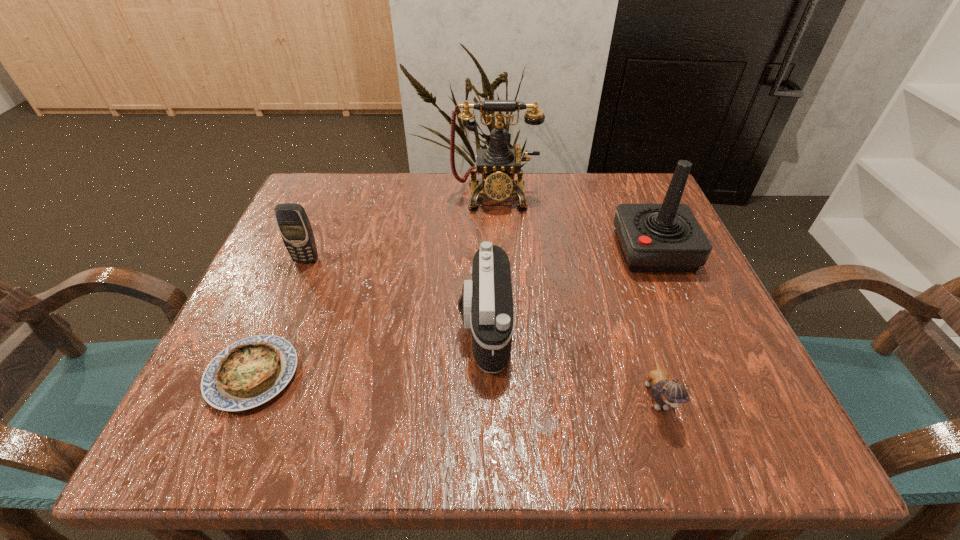
Find the location of a particular element. Image resolution: width=960 pixels, height=540 pixels. quiche situated at the left edge is located at coordinates (249, 372).

The width and height of the screenshot is (960, 540). Find the location of `joystick located in the right edge section of the desktop`. joystick located in the right edge section of the desktop is located at coordinates (667, 237).

Where is `kitten that is at the right edge`? The height and width of the screenshot is (540, 960). kitten that is at the right edge is located at coordinates (666, 392).

You are a GUI agent. You are given a task and a screenshot of the screen. Output one action in this format:
    pyautogui.click(x=<x>, y=<y>)
    Task: Click on the object at the near left corner
    Image resolution: width=960 pixels, height=540 pixels.
    Given the screenshot: What is the action you would take?
    pyautogui.click(x=249, y=372)

You are a GUI agent. You are given a task and a screenshot of the screen. Output one action in this format:
    pyautogui.click(x=<x>, y=<y>)
    Task: Click on the object present at the far right corner
    
    Given the screenshot: What is the action you would take?
    pyautogui.click(x=667, y=237)

Locate an element on the screen. The width and height of the screenshot is (960, 540). object that is at the near right corner is located at coordinates (666, 392).

Find the location of a particular element. Image resolution: width=960 pixels, height=540 pixels. vacant region at the far edge of the desktop is located at coordinates (566, 223).

Locate an element on the screen. The image size is (960, 540). free space at the near edge of the desktop is located at coordinates (627, 440).

In the image, there is a desktop. Where is `vacant space at the left edge`? vacant space at the left edge is located at coordinates (340, 263).

In the image, there is a desktop. Where is `vacant space at the right edge`? vacant space at the right edge is located at coordinates (697, 319).